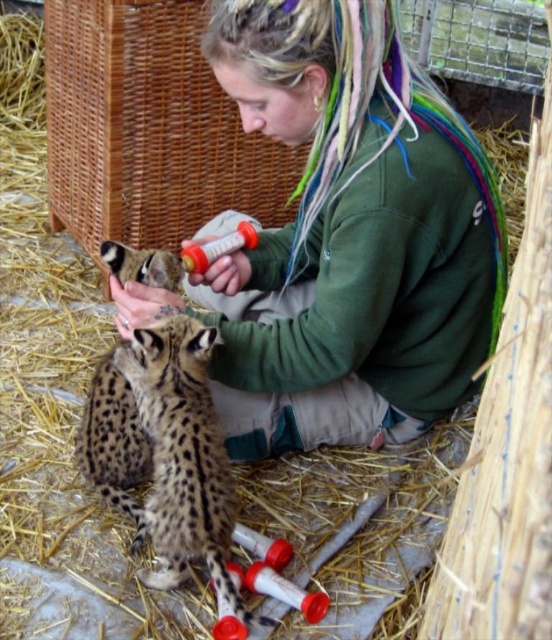
Question: In this image, where is green fleece jacket at center located relative to spotted fur cheetah at center?

Choices:
 (A) left
 (B) right

Answer: (B)

Question: Considering the relative positions of green fleece jacket at center and spotted fur cheetah at center in the image provided, where is green fleece jacket at center located with respect to spotted fur cheetah at center?

Choices:
 (A) left
 (B) right

Answer: (B)

Question: Which object is farther from the camera taking this photo?

Choices:
 (A) spotted fur cheetah at center
 (B) green fleece jacket at center

Answer: (A)

Question: Is green fleece jacket at center further to the viewer compared to spotted fur cheetah at center?

Choices:
 (A) yes
 (B) no

Answer: (B)